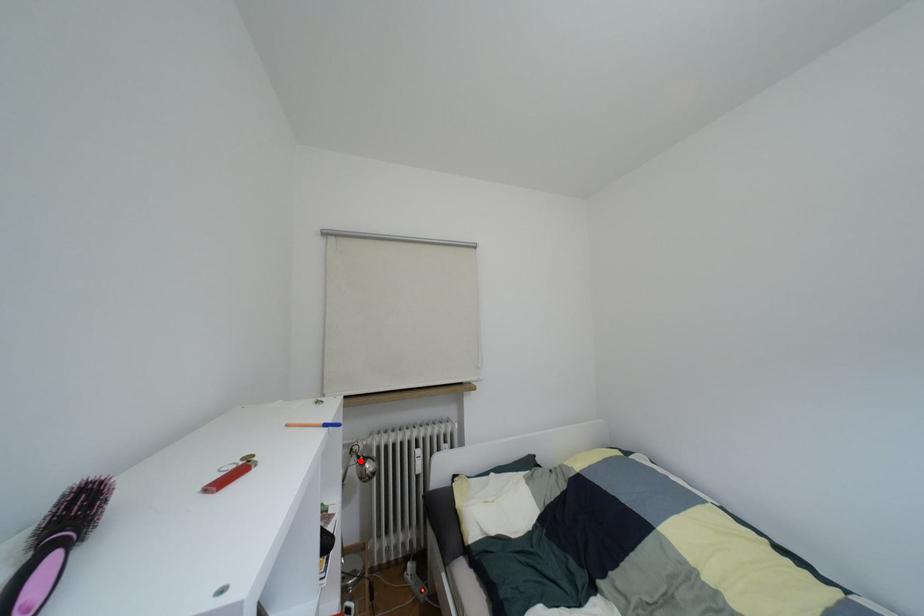
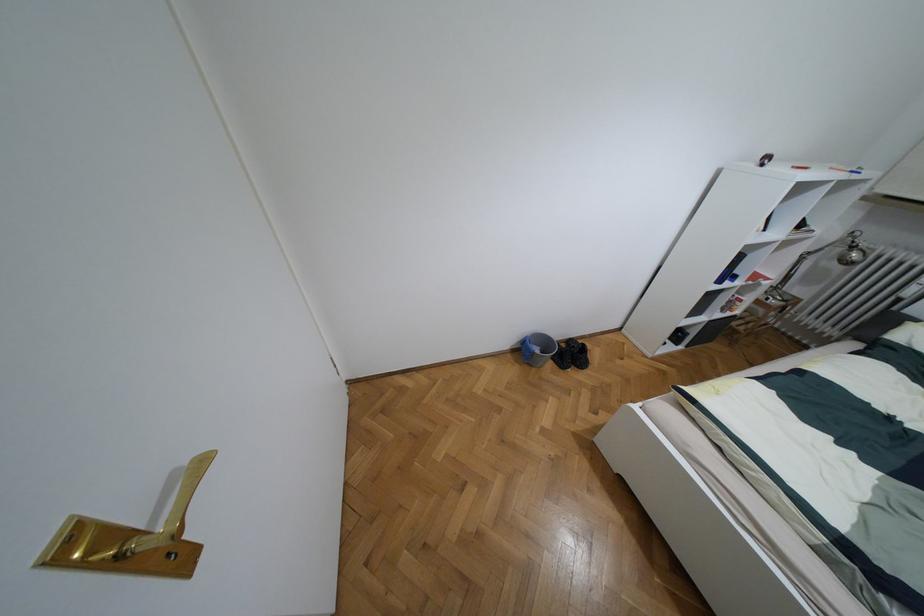
Where in the second image is the point corresponding to the highlighted location from the first image?

(852, 246)